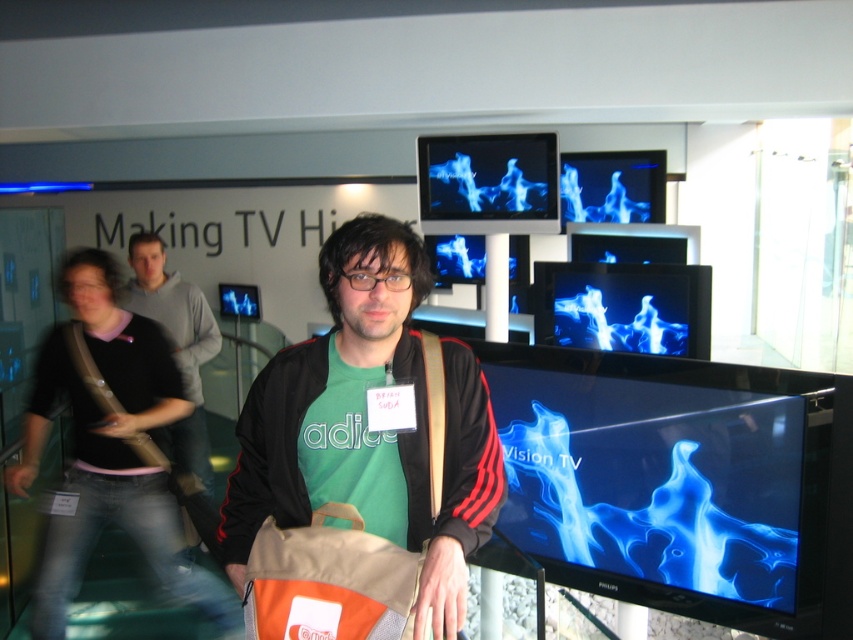
You are a customer in the electronics store. You see the man in the green fabric shirt at center. Where is the man located relative to the point at coordinates (367,428)?

The green fabric shirt at center is represented by point at coordinates (367,428), so the man is located exactly at that point.